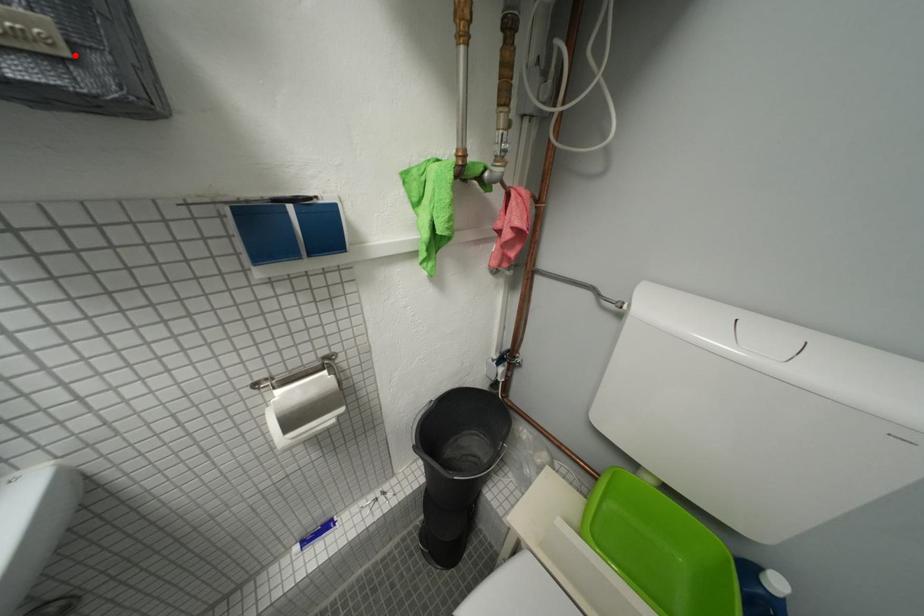
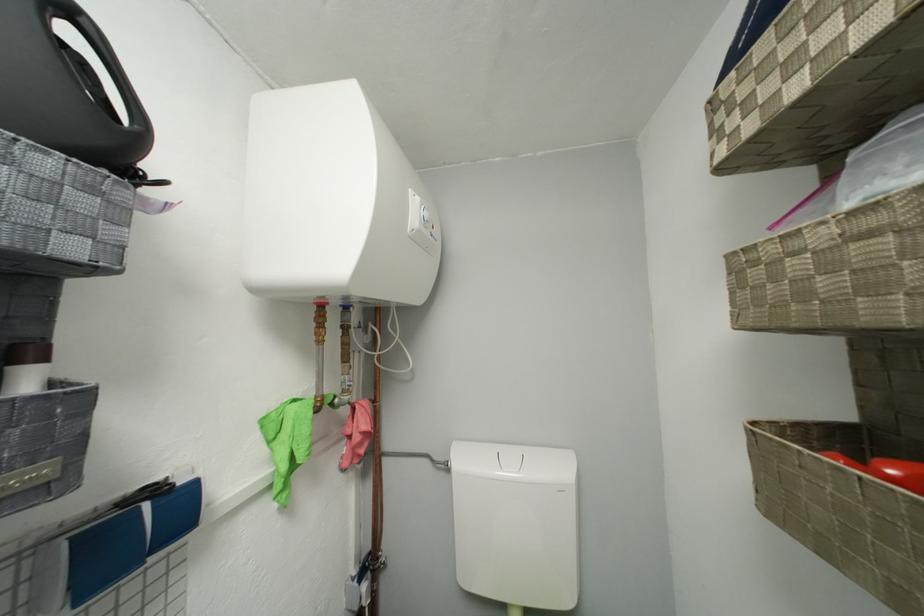
Locate, in the second image, the point that corresponds to the highlighted location in the first image.

(66, 477)